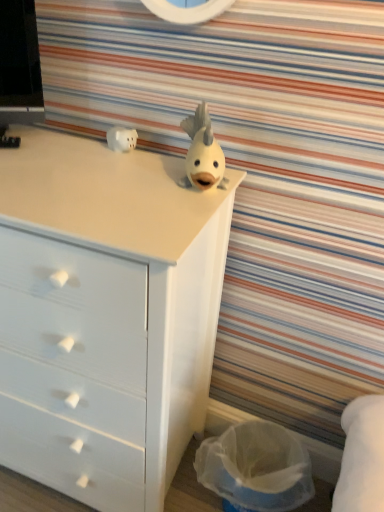
Describe the element at coordinates (202, 153) in the screenshot. I see `white matte fish at center, placed as the 1th toy when sorted from front to back` at that location.

You are a GUI agent. You are given a task and a screenshot of the screen. Output one action in this format:
    pyautogui.click(x=<x>, y=<y>)
    Task: Click on the translucent plastic laundry basket at lower right
    
    Given the screenshot: What is the action you would take?
    pyautogui.click(x=256, y=467)

Is white matte piggy bank at upper left, the 1th toy in the left-to-right sequence, directly adjacent to white matte fish at center, which appears as the first toy when viewed from the right?

No, white matte piggy bank at upper left, the 1th toy in the left-to-right sequence, is not in contact with white matte fish at center, which appears as the first toy when viewed from the right.

Considering the positions of objects white matte piggy bank at upper left, the 1th toy in the left-to-right sequence, and white matte fish at center, positioned as the second toy in left-to-right order, in the image provided, who is more to the left, white matte piggy bank at upper left, the 1th toy in the left-to-right sequence, or white matte fish at center, positioned as the second toy in left-to-right order,?

Positioned to the left is white matte piggy bank at upper left, the 1th toy in the left-to-right sequence.

From the image's perspective, is white matte piggy bank at upper left, placed as the 1th toy when sorted from back to front, located above white matte fish at center, which appears as the first toy when viewed from the right?

Yes, from the image's perspective, white matte piggy bank at upper left, placed as the 1th toy when sorted from back to front, is on top of white matte fish at center, which appears as the first toy when viewed from the right.

In the scene shown: Is white matte piggy bank at upper left, placed as the 1th toy when sorted from back to front, oriented towards white matte fish at center, which appears as the first toy when viewed from the right?

Yes, white matte piggy bank at upper left, placed as the 1th toy when sorted from back to front, is facing white matte fish at center, which appears as the first toy when viewed from the right.

How far apart are white matte fish at center, the second toy positioned from the back, and translucent plastic laundry basket at lower right?

white matte fish at center, the second toy positioned from the back, is 32.60 inches away from translucent plastic laundry basket at lower right.

From a real-world perspective, is white matte fish at center, positioned as the second toy in left-to-right order, on translucent plastic laundry basket at lower right?

Yes.

Is white matte fish at center, positioned as the second toy in left-to-right order, closer to the viewer compared to translucent plastic laundry basket at lower right?

Yes.

Are translucent plastic laundry basket at lower right and white matte chest of drawers at upper center making contact?

No, translucent plastic laundry basket at lower right is not beside white matte chest of drawers at upper center.

Find the location of a particular element. This screenshot has width=384, height=512. laundry basket below the white matte chest of drawers at upper center (from the image's perspective) is located at coordinates (256, 467).

In terms of height, does translucent plastic laundry basket at lower right look taller or shorter compared to white matte chest of drawers at upper center?

In the image, translucent plastic laundry basket at lower right appears to be shorter than white matte chest of drawers at upper center.

Would you say white matte fish at center, which appears as the first toy when viewed from the right, is inside or outside white matte chest of drawers at upper center?

white matte fish at center, which appears as the first toy when viewed from the right, is not inside white matte chest of drawers at upper center, it's outside.

Does point (210, 162) lie behind point (150, 163)?

No, (210, 162) is in front of (150, 163).

Can you confirm if white matte fish at center, the second toy positioned from the back, is smaller than white matte chest of drawers at upper center?

Yes, white matte fish at center, the second toy positioned from the back, is smaller than white matte chest of drawers at upper center.

Find the location of a particular element. Image resolution: width=384 pixels, height=512 pixels. toy that is the 1st one when counting backward from the white matte chest of drawers at upper center is located at coordinates (202, 153).

Is white matte piggy bank at upper left, placed as the 1th toy when sorted from back to front, inside or outside of translucent plastic laundry basket at lower right?

white matte piggy bank at upper left, placed as the 1th toy when sorted from back to front, is located beyond the bounds of translucent plastic laundry basket at lower right.

From a real-world perspective, is white matte piggy bank at upper left, the second toy positioned from the front, positioned above or below translucent plastic laundry basket at lower right?

white matte piggy bank at upper left, the second toy positioned from the front, is situated higher than translucent plastic laundry basket at lower right in the real world.

Does white matte piggy bank at upper left, which is counted as the second toy, starting from the right, have a greater width compared to translucent plastic laundry basket at lower right?

Incorrect, the width of white matte piggy bank at upper left, which is counted as the second toy, starting from the right, does not surpass that of translucent plastic laundry basket at lower right.

Who is shorter, white matte piggy bank at upper left, the 1th toy in the left-to-right sequence, or translucent plastic laundry basket at lower right?

white matte piggy bank at upper left, the 1th toy in the left-to-right sequence, is shorter.

Does translucent plastic laundry basket at lower right contain white matte piggy bank at upper left, the 1th toy in the left-to-right sequence?

No, white matte piggy bank at upper left, the 1th toy in the left-to-right sequence, is not inside translucent plastic laundry basket at lower right.

Is translucent plastic laundry basket at lower right to the right of white matte piggy bank at upper left, placed as the 1th toy when sorted from back to front, from the viewer's perspective?

Correct, you'll find translucent plastic laundry basket at lower right to the right of white matte piggy bank at upper left, placed as the 1th toy when sorted from back to front.

Are translucent plastic laundry basket at lower right and white matte piggy bank at upper left, the 1th toy in the left-to-right sequence, beside each other?

translucent plastic laundry basket at lower right is not next to white matte piggy bank at upper left, the 1th toy in the left-to-right sequence, and they're not touching.

Who is smaller, translucent plastic laundry basket at lower right or white matte piggy bank at upper left, which is counted as the second toy, starting from the right?

Smaller between the two is white matte piggy bank at upper left, which is counted as the second toy, starting from the right.

Which point is more forward, (229, 477) or (196, 141)?

The point (196, 141) is in front.

Which object is further away from the camera, translucent plastic laundry basket at lower right or white matte fish at center, the second toy positioned from the back?

translucent plastic laundry basket at lower right is behind.

Is translucent plastic laundry basket at lower right beside white matte fish at center, which appears as the first toy when viewed from the right?

There is a gap between translucent plastic laundry basket at lower right and white matte fish at center, which appears as the first toy when viewed from the right.

Looking at their sizes, would you say translucent plastic laundry basket at lower right is wider or thinner than white matte fish at center, the second toy positioned from the back?

In the image, translucent plastic laundry basket at lower right appears to be wider than white matte fish at center, the second toy positioned from the back.

Where is `toy behind the white matte fish at center, the second toy positioned from the back`? The height and width of the screenshot is (512, 384). toy behind the white matte fish at center, the second toy positioned from the back is located at coordinates [x=121, y=139].

You are a GUI agent. You are given a task and a screenshot of the screen. Output one action in this format:
    pyautogui.click(x=<x>, y=<y>)
    Task: Click on the 1st toy above the translucent plastic laundry basket at lower right (from the image's perspective)
    This screenshot has height=512, width=384.
    Given the screenshot: What is the action you would take?
    pyautogui.click(x=202, y=153)

Looking at the image, which one is located closer to white matte chest of drawers at upper center, translucent plastic laundry basket at lower right or white matte fish at center, positioned as the second toy in left-to-right order?

Based on the image, white matte fish at center, positioned as the second toy in left-to-right order, appears to be nearer to white matte chest of drawers at upper center.

From the image, which object appears to be farther from translucent plastic laundry basket at lower right, white matte fish at center, which appears as the first toy when viewed from the right, or white matte chest of drawers at upper center?

white matte fish at center, which appears as the first toy when viewed from the right.

Considering their positions, is translucent plastic laundry basket at lower right positioned further to white matte fish at center, positioned as the second toy in left-to-right order, than white matte piggy bank at upper left, which is counted as the second toy, starting from the right?

The object further to white matte fish at center, positioned as the second toy in left-to-right order, is translucent plastic laundry basket at lower right.

Considering their positions, is white matte chest of drawers at upper center positioned further to white matte piggy bank at upper left, placed as the 1th toy when sorted from back to front, than translucent plastic laundry basket at lower right?

Based on the image, translucent plastic laundry basket at lower right appears to be further to white matte piggy bank at upper left, placed as the 1th toy when sorted from back to front.

Looking at this image, from the image, which object appears to be nearer to translucent plastic laundry basket at lower right, white matte piggy bank at upper left, the 1th toy in the left-to-right sequence, or white matte chest of drawers at upper center?

white matte chest of drawers at upper center is positioned closer to the anchor translucent plastic laundry basket at lower right.

From the image, which object appears to be nearer to white matte fish at center, placed as the 1th toy when sorted from front to back, white matte chest of drawers at upper center or translucent plastic laundry basket at lower right?

white matte chest of drawers at upper center is closer to white matte fish at center, placed as the 1th toy when sorted from front to back.

Considering their positions, is white matte chest of drawers at upper center positioned closer to white matte piggy bank at upper left, placed as the 1th toy when sorted from back to front, than white matte fish at center, placed as the 1th toy when sorted from front to back?

white matte fish at center, placed as the 1th toy when sorted from front to back, lies closer to white matte piggy bank at upper left, placed as the 1th toy when sorted from back to front, than the other object.

Considering their positions, is white matte piggy bank at upper left, placed as the 1th toy when sorted from back to front, positioned further to white matte chest of drawers at upper center than translucent plastic laundry basket at lower right?

white matte piggy bank at upper left, placed as the 1th toy when sorted from back to front, is further to white matte chest of drawers at upper center.

Find the location of a particular element. This screenshot has width=384, height=512. chest of drawers between white matte piggy bank at upper left, placed as the 1th toy when sorted from back to front, and translucent plastic laundry basket at lower right in the up-down direction is located at coordinates (105, 315).

You are a GUI agent. You are given a task and a screenshot of the screen. Output one action in this format:
    pyautogui.click(x=<x>, y=<y>)
    Task: Click on the chest of drawers between white matte fish at center, placed as the 1th toy when sorted from front to back, and translucent plastic laundry basket at lower right from top to bottom
    The image size is (384, 512).
    Given the screenshot: What is the action you would take?
    pyautogui.click(x=105, y=315)

Where is `toy that lies between white matte piggy bank at upper left, the second toy positioned from the front, and translucent plastic laundry basket at lower right from top to bottom`? The height and width of the screenshot is (512, 384). toy that lies between white matte piggy bank at upper left, the second toy positioned from the front, and translucent plastic laundry basket at lower right from top to bottom is located at coordinates (202, 153).

Find the location of `toy that lies between white matte piggy bank at upper left, the second toy positioned from the front, and white matte chest of drawers at upper center from top to bottom`. toy that lies between white matte piggy bank at upper left, the second toy positioned from the front, and white matte chest of drawers at upper center from top to bottom is located at coordinates (202, 153).